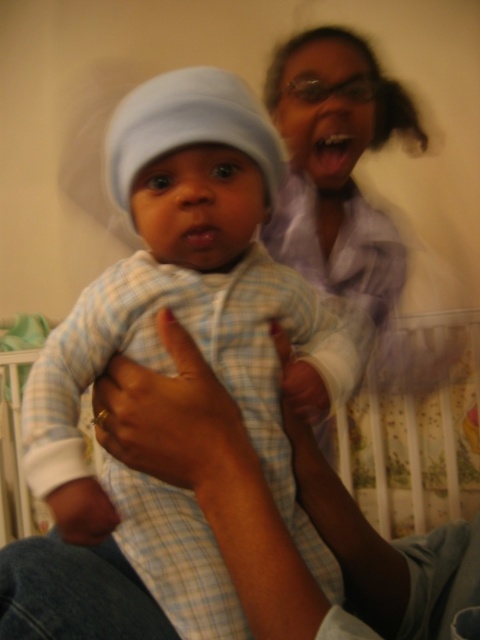
Is light blue plaid onesie at center to the left of light blue plaid fabric at center from the viewer's perspective?

Indeed, light blue plaid onesie at center is positioned on the left side of light blue plaid fabric at center.

What do you see at coordinates (190, 333) in the screenshot? I see `light blue plaid onesie at center` at bounding box center [190, 333].

Is point (167, 616) farther from camera compared to point (471, 337)?

No, it is in front of (471, 337).

The width and height of the screenshot is (480, 640). Find the location of `light blue plaid onesie at center`. light blue plaid onesie at center is located at coordinates (190, 333).